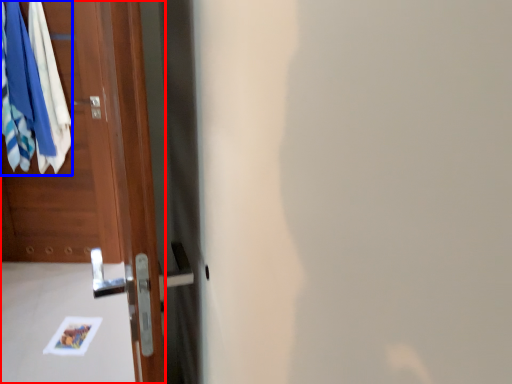
Question: Which of the following is the closest to the observer, door (highlighted by a red box) or clothing (highlighted by a blue box)?

Choices:
 (A) door
 (B) clothing

Answer: (A)